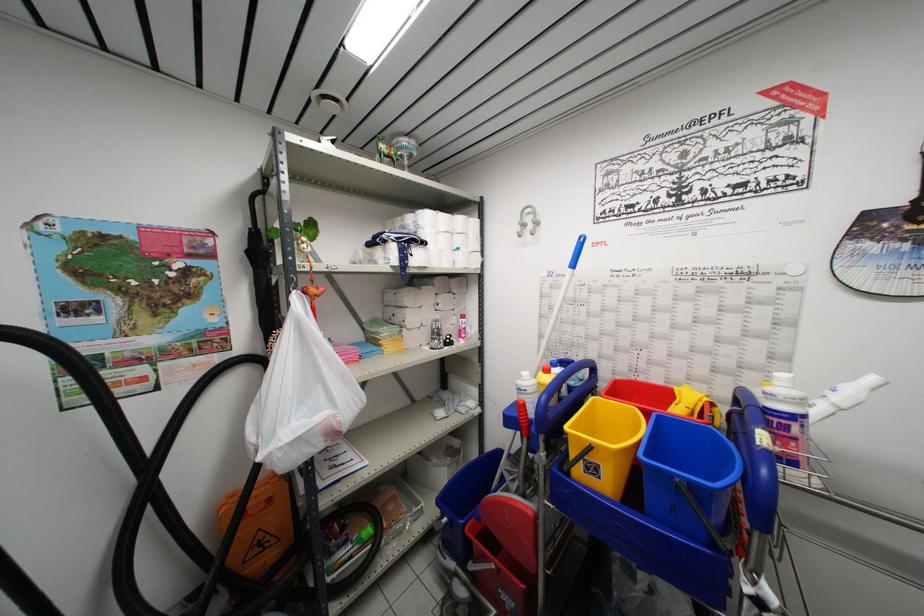
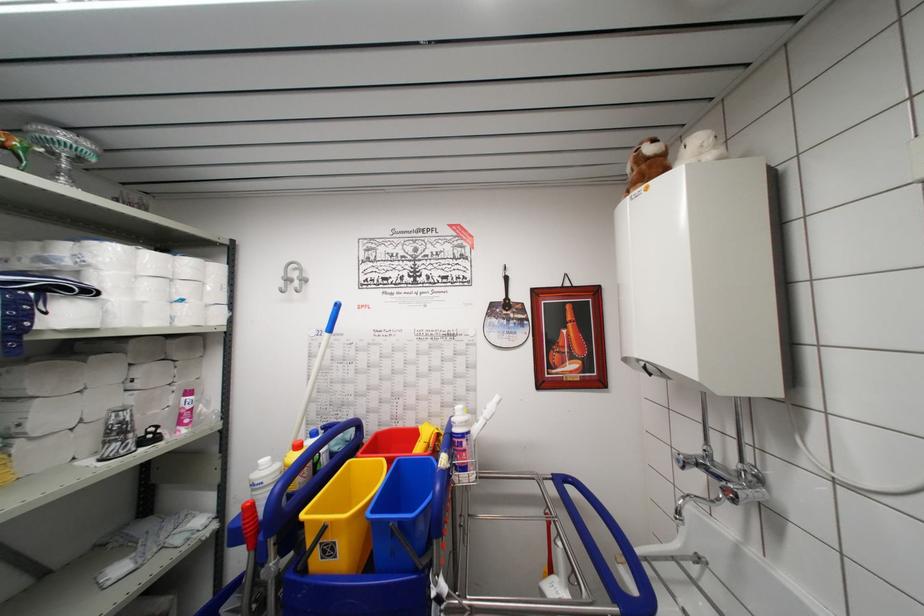
Locate, in the second image, the point that corresponds to [445,254] in the first image.

(149, 307)